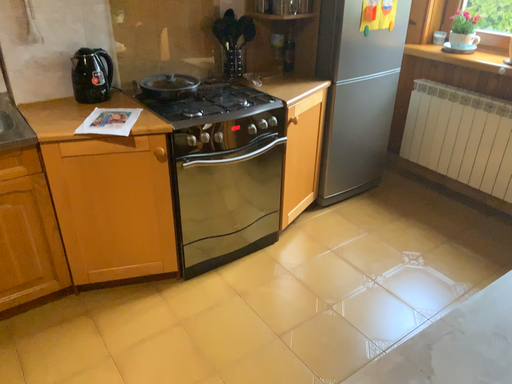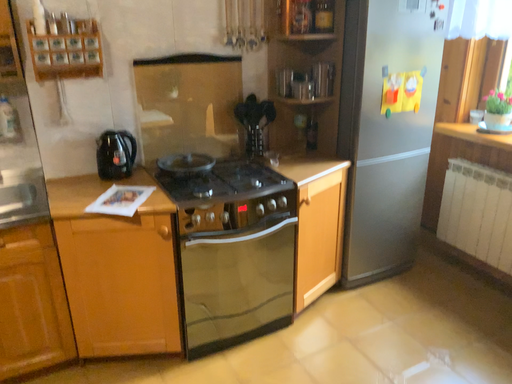
Question: How did the camera likely rotate when shooting the video?

Choices:
 (A) rotated downward
 (B) rotated upward

Answer: (B)